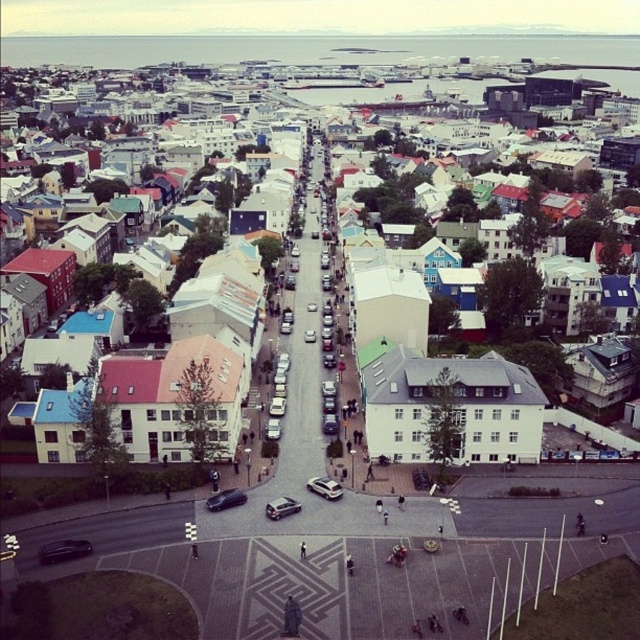
Question: Can you confirm if shiny black car at center is smaller than shiny silver car at center?

Choices:
 (A) yes
 (B) no

Answer: (A)

Question: Is white matte building at center above shiny silver car at center?

Choices:
 (A) yes
 (B) no

Answer: (A)

Question: Among these points, which one is farthest from the camera?

Choices:
 (A) (490, 285)
 (B) (65, 554)
 (C) (209, 497)
 (D) (291, 504)

Answer: (A)

Question: Which point is farther from the camera taking this photo?

Choices:
 (A) (513, 445)
 (B) (296, 500)

Answer: (A)

Question: Which point is closer to the camera?

Choices:
 (A) shiny black car at center
 (B) silver metallic hatchback at center
 (C) shiny silver car at center
 (D) white matte building at center

Answer: (A)

Question: Is white matte building at center to the right of shiny silver car at center from the viewer's perspective?

Choices:
 (A) no
 (B) yes

Answer: (B)